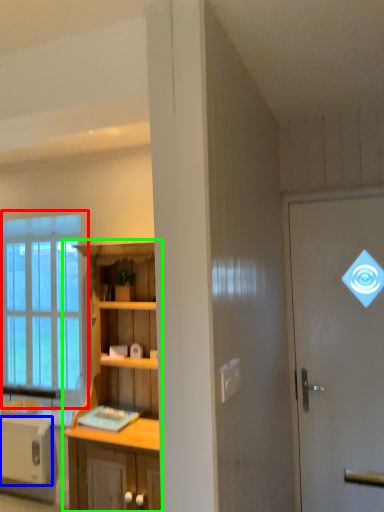
Question: Estimate the real-world distances between objects in this image. Which object is farther from window (highlighted by a red box), appliance (highlighted by a blue box) or cabinetry (highlighted by a green box)?

Choices:
 (A) appliance
 (B) cabinetry

Answer: (B)